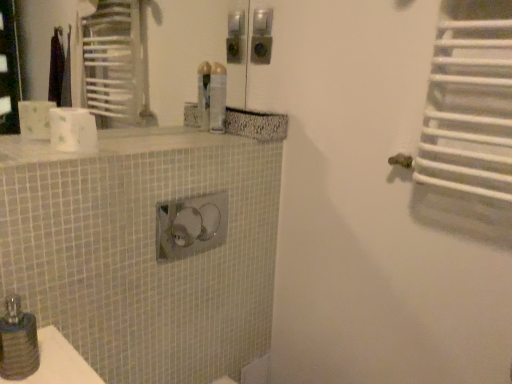
Question: Is the depth of white matte toilet paper at upper left greater than that of translucent plastic spray can at upper center?

Choices:
 (A) no
 (B) yes

Answer: (A)

Question: Can translucent plastic spray can at upper center be found inside white matte toilet paper at upper left?

Choices:
 (A) yes
 (B) no

Answer: (B)

Question: Considering the relative positions of white matte toilet paper at upper left and translucent plastic spray can at upper center in the image provided, is white matte toilet paper at upper left to the left of translucent plastic spray can at upper center from the viewer's perspective?

Choices:
 (A) yes
 (B) no

Answer: (A)

Question: Does white matte toilet paper at upper left have a greater height compared to translucent plastic spray can at upper center?

Choices:
 (A) no
 (B) yes

Answer: (A)

Question: From a real-world perspective, is white matte toilet paper at upper left positioned over translucent plastic spray can at upper center based on gravity?

Choices:
 (A) no
 (B) yes

Answer: (A)

Question: Considering the positions of translucent plastic spray can at upper center and white mosaic tile counter top at upper center in the image, is translucent plastic spray can at upper center bigger or smaller than white mosaic tile counter top at upper center?

Choices:
 (A) small
 (B) big

Answer: (A)

Question: From the image's perspective, is translucent plastic spray can at upper center above or below white mosaic tile counter top at upper center?

Choices:
 (A) below
 (B) above

Answer: (B)

Question: Looking at their shapes, would you say translucent plastic spray can at upper center is wider or thinner than white mosaic tile counter top at upper center?

Choices:
 (A) thin
 (B) wide

Answer: (A)

Question: Is translucent plastic spray can at upper center in front of or behind white mosaic tile counter top at upper center in the image?

Choices:
 (A) behind
 (B) front

Answer: (A)

Question: Is white matte toilet paper at upper left in front of or behind white mosaic tile counter top at upper center in the image?

Choices:
 (A) behind
 (B) front

Answer: (A)

Question: Looking at their shapes, would you say white matte toilet paper at upper left is wider or thinner than white mosaic tile counter top at upper center?

Choices:
 (A) thin
 (B) wide

Answer: (A)

Question: From the image's perspective, is white matte toilet paper at upper left above or below white mosaic tile counter top at upper center?

Choices:
 (A) above
 (B) below

Answer: (A)

Question: Considering the positions of point (57, 110) and point (10, 145), is point (57, 110) closer or farther from the camera than point (10, 145)?

Choices:
 (A) farther
 (B) closer

Answer: (A)

Question: Is matte black soap dispenser at lower left bigger or smaller than white matte toilet paper at upper left?

Choices:
 (A) small
 (B) big

Answer: (A)

Question: In terms of width, does matte black soap dispenser at lower left look wider or thinner when compared to white matte toilet paper at upper left?

Choices:
 (A) wide
 (B) thin

Answer: (B)